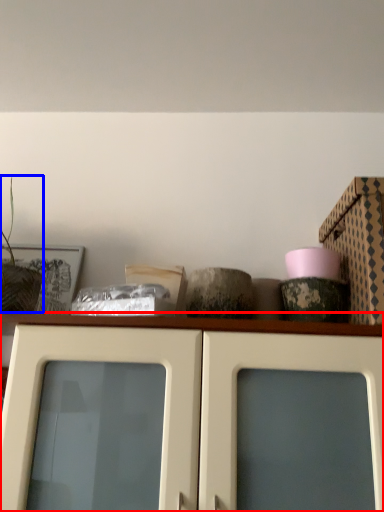
Question: Which object appears farthest to the camera in this image, cabinetry (highlighted by a red box) or plant (highlighted by a blue box)?

Choices:
 (A) cabinetry
 (B) plant

Answer: (B)